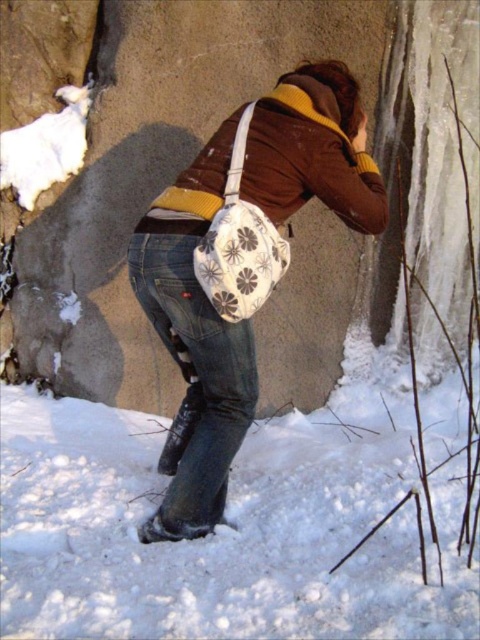
Question: Does white fluffy snow at lower left appear over floral fabric bag at center?

Choices:
 (A) no
 (B) yes

Answer: (A)

Question: Among these points, which one is farthest from the camera?

Choices:
 (A) (250, 168)
 (B) (305, 172)
 (C) (392, 458)

Answer: (C)

Question: Does floral fabric bag at center appear on the right side of brown matte jacket at center?

Choices:
 (A) yes
 (B) no

Answer: (B)

Question: Which object appears closest to the camera in this image?

Choices:
 (A) white fluffy snow at lower left
 (B) floral fabric bag at center

Answer: (A)

Question: Is white fluffy snow at lower left positioned before brown matte jacket at center?

Choices:
 (A) no
 (B) yes

Answer: (B)

Question: Among these objects, which one is nearest to the camera?

Choices:
 (A) white fluffy snow at lower left
 (B) brown matte jacket at center
 (C) floral fabric bag at center

Answer: (A)